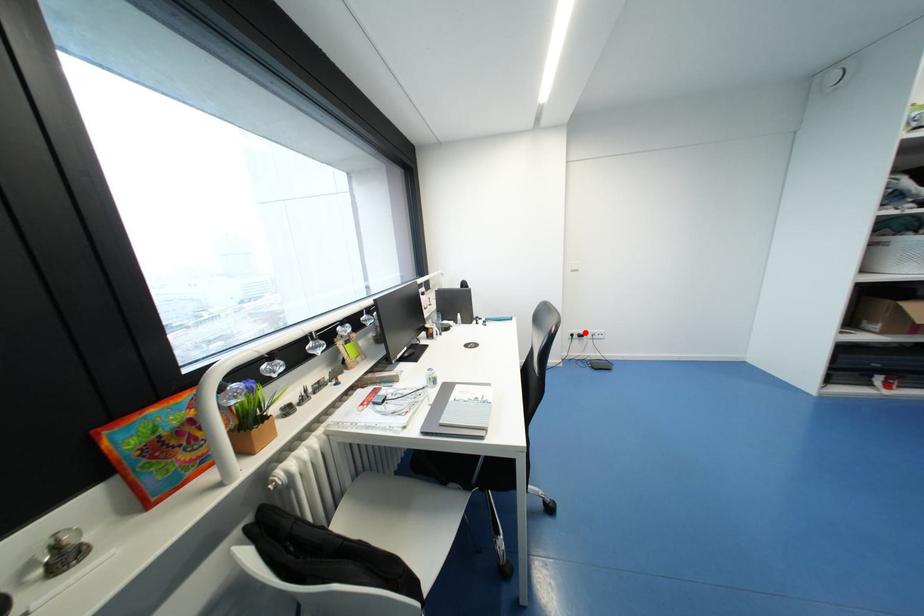
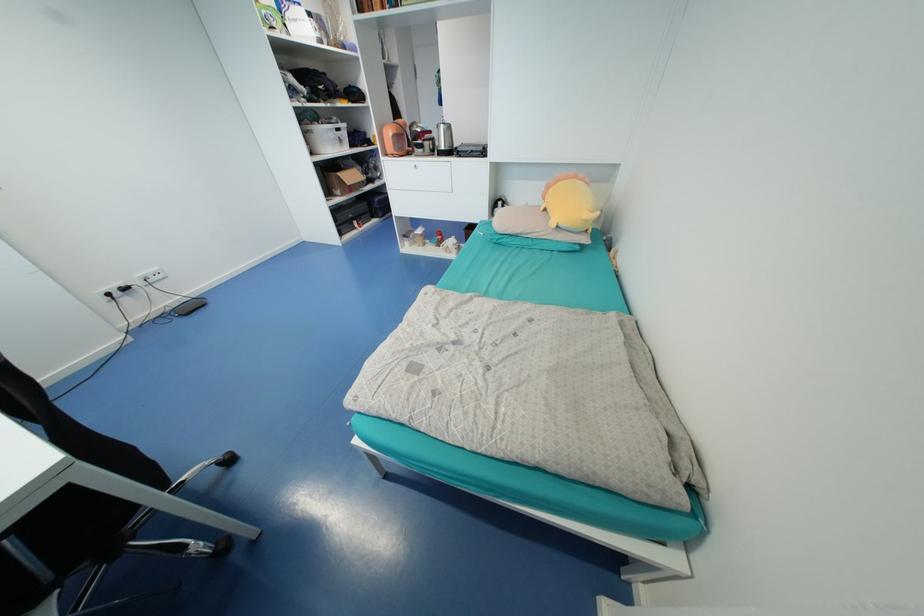
Where in the second image is the point corresponding to the highlighted location from the first image?

(125, 285)